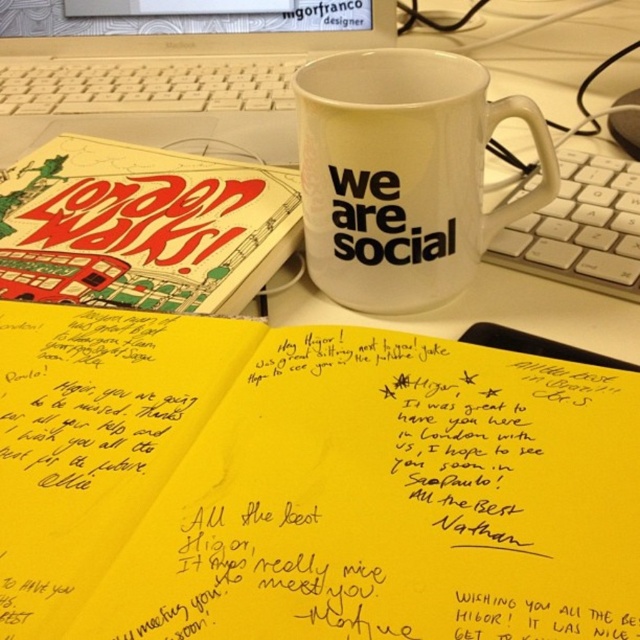
Question: Can you confirm if white matte mug at center is positioned below white plastic laptop at upper center?

Choices:
 (A) yes
 (B) no

Answer: (A)

Question: Is white matte mug at center to the right of white plastic keyboard at upper right from the viewer's perspective?

Choices:
 (A) yes
 (B) no

Answer: (B)

Question: Among these points, which one is farthest from the camera?

Choices:
 (A) (49, 136)
 (B) (216, 292)

Answer: (A)

Question: Which object is farther from the camera taking this photo?

Choices:
 (A) white plastic laptop at upper center
 (B) white matte mug at center
 (C) yellow paper notebook at center
 (D) matte paper book at upper left

Answer: (A)

Question: Is yellow paper notebook at center closer to the viewer compared to matte paper book at upper left?

Choices:
 (A) no
 (B) yes

Answer: (B)

Question: Which point is farther to the camera?

Choices:
 (A) white plastic laptop at upper center
 (B) white matte mug at center
 (C) white plastic keyboard at upper right
 (D) matte paper book at upper left

Answer: (A)